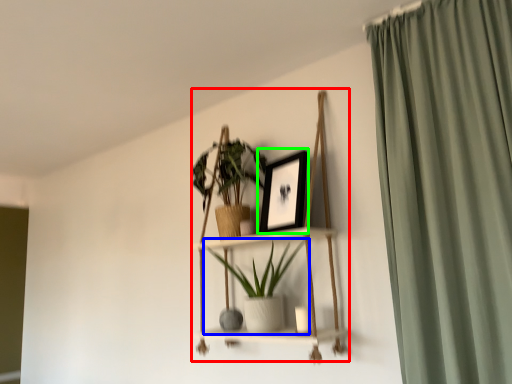
Question: Which object is positioned farthest from cabinet (highlighted by a red box)? Select from houseplant (highlighted by a blue box) and picture frame (highlighted by a green box).

Choices:
 (A) houseplant
 (B) picture frame

Answer: (B)